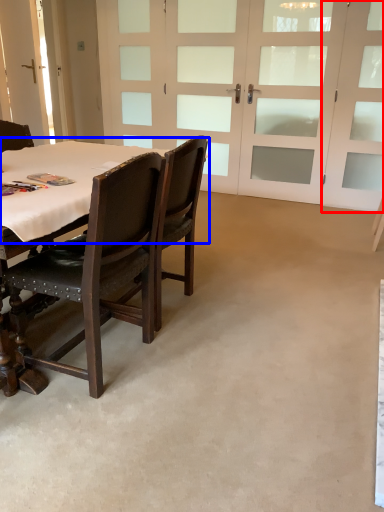
Question: Which point is closer to the camera, screen door (highlighted by a red box) or table top (highlighted by a blue box)?

Choices:
 (A) screen door
 (B) table top

Answer: (B)